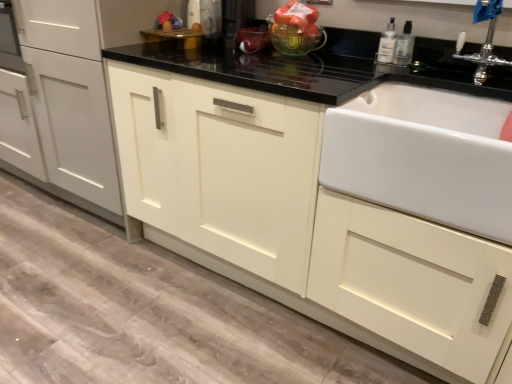
Question: Is clear plastic bottle at upper right, which is the second bottle from left to right, at the left side of translucent glass bowl at upper center?

Choices:
 (A) yes
 (B) no

Answer: (B)

Question: Is clear plastic bottle at upper right, the 1th bottle positioned from the right, completely or partially outside of translucent glass bowl at upper center?

Choices:
 (A) yes
 (B) no

Answer: (A)

Question: From a real-world perspective, is clear plastic bottle at upper right, the 1th bottle positioned from the right, under translucent glass bowl at upper center?

Choices:
 (A) no
 (B) yes

Answer: (B)

Question: Does clear plastic bottle at upper right, which is the second bottle from left to right, appear on the right side of translucent glass bowl at upper center?

Choices:
 (A) no
 (B) yes

Answer: (B)

Question: Can you confirm if clear plastic bottle at upper right, the 1th bottle positioned from the right, is smaller than translucent glass bowl at upper center?

Choices:
 (A) no
 (B) yes

Answer: (B)

Question: Would you say silver metallic faucet at upper right is inside or outside matte white cabinet at center, the second cabinetry when ordered from left to right?

Choices:
 (A) outside
 (B) inside

Answer: (B)

Question: Is point (468, 56) closer or farther from the camera than point (274, 292)?

Choices:
 (A) farther
 (B) closer

Answer: (B)

Question: Is silver metallic faucet at upper right taller or shorter than matte white cabinet at center, the second cabinetry when ordered from left to right?

Choices:
 (A) short
 (B) tall

Answer: (A)

Question: Would you say silver metallic faucet at upper right is to the left or to the right of matte white cabinet at center, the second cabinetry when ordered from left to right, in the picture?

Choices:
 (A) left
 (B) right

Answer: (B)

Question: Based on their sizes in the image, would you say translucent glass bowl at upper center is bigger or smaller than clear plastic bottle at upper right, the second bottle when ordered from right to left?

Choices:
 (A) small
 (B) big

Answer: (B)

Question: From the image's perspective, relative to clear plastic bottle at upper right, positioned as the 1th bottle in left-to-right order, is translucent glass bowl at upper center above or below?

Choices:
 (A) above
 (B) below

Answer: (A)

Question: From their relative heights in the image, would you say translucent glass bowl at upper center is taller or shorter than clear plastic bottle at upper right, positioned as the 1th bottle in left-to-right order?

Choices:
 (A) tall
 (B) short

Answer: (A)

Question: Relative to clear plastic bottle at upper right, positioned as the 1th bottle in left-to-right order, is translucent glass bowl at upper center in front or behind?

Choices:
 (A) front
 (B) behind

Answer: (B)

Question: From the image's perspective, is silver metallic faucet at upper right positioned above or below clear plastic bottle at upper right, the second bottle when ordered from right to left?

Choices:
 (A) above
 (B) below

Answer: (B)

Question: Is point (476, 61) positioned closer to the camera than point (386, 29)?

Choices:
 (A) farther
 (B) closer

Answer: (B)